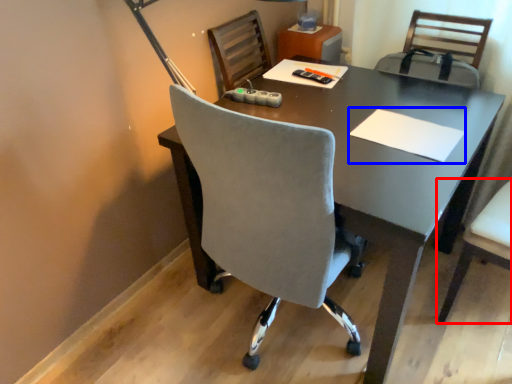
Question: Which point is closer to the camera, chair (highlighted by a red box) or notepad (highlighted by a blue box)?

Choices:
 (A) chair
 (B) notepad

Answer: (A)